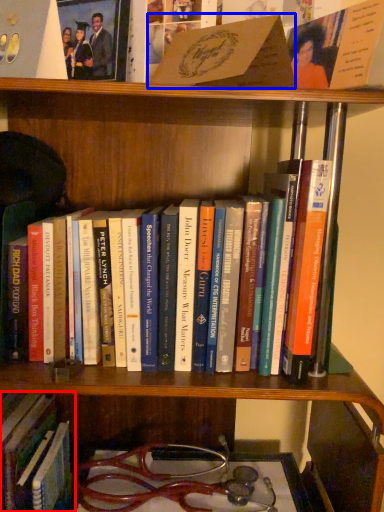
Question: Which of the following is the farthest to the observer, book (highlighted by a red box) or book (highlighted by a blue box)?

Choices:
 (A) book
 (B) book

Answer: (A)